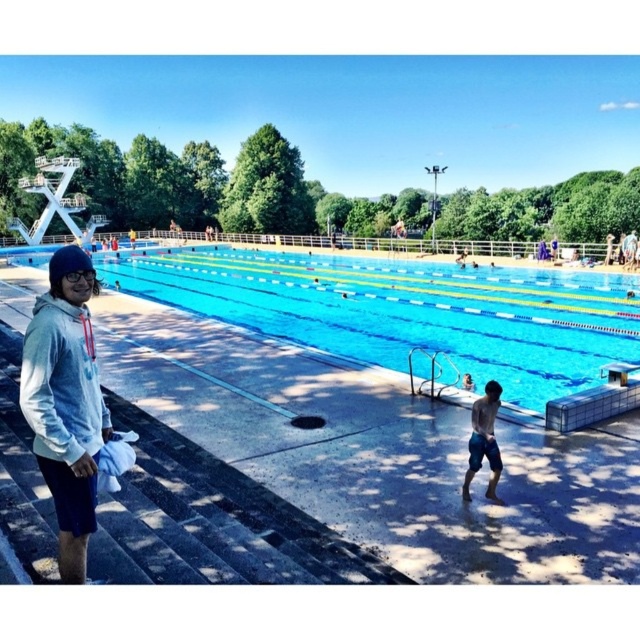
You are a lifeguard observing the pool area. You notice two items near the edge of the pool. Which item is wider between the blue denim shorts at lower right and the transparent plastic goggles at left?

The blue denim shorts at lower right is wider than the transparent plastic goggles at left according to the description.

You are standing at the edge of the pool and see the blue denim shorts at lower right. Where exactly are they located in relation to the pool?

The blue denim shorts at lower right are located at point coordinates of 0.689 on the x axis and 0.756 on the y axis.

You are a lifeguard observing the pool area. You notice the blue denim shorts at lower right and the transparent plastic goggles at left. Which item is positioned more to the right side of the pool area?

The blue denim shorts at lower right is positioned more to the right side of the pool area than the transparent plastic goggles at left.